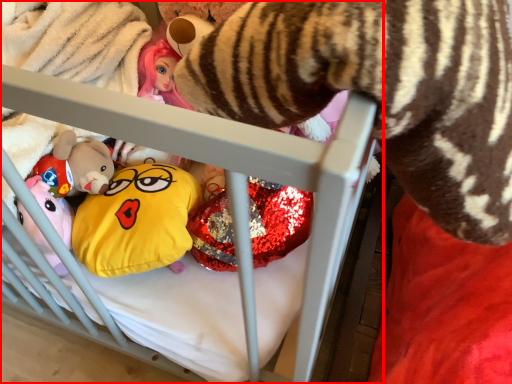
Question: From the image's perspective, where is infant bed (annotated by the red box) located relative to toy?

Choices:
 (A) above
 (B) below

Answer: (A)